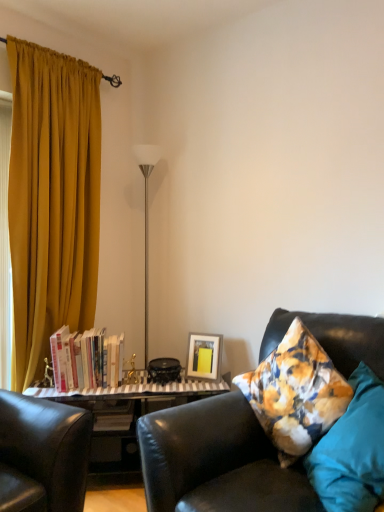
Question: Considering their positions, is matte yellow picture frame at center located in front of or behind leather couch at right?

Choices:
 (A) front
 (B) behind

Answer: (B)

Question: Visually, is matte yellow picture frame at center positioned to the left or to the right of leather couch at right?

Choices:
 (A) left
 (B) right

Answer: (A)

Question: Based on their relative distances, which object is nearer to the teal fabric pillow at right?

Choices:
 (A) matte yellow picture frame at center
 (B) hardcover books at left
 (C) mustard fabric curtain at left
 (D) leather couch at right
 (E) silver/metallic floor lamp at center

Answer: (D)

Question: Which of these objects is positioned farthest from the silver/metallic floor lamp at center?

Choices:
 (A) mustard fabric curtain at left
 (B) leather couch at right
 (C) hardcover books at left
 (D) teal fabric pillow at right
 (E) matte yellow picture frame at center

Answer: (D)